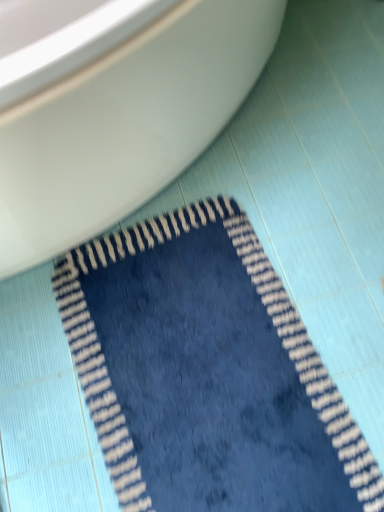
Image resolution: width=384 pixels, height=512 pixels. Identify the location of free space in front of white glossy toilet at upper left. click(x=195, y=357).